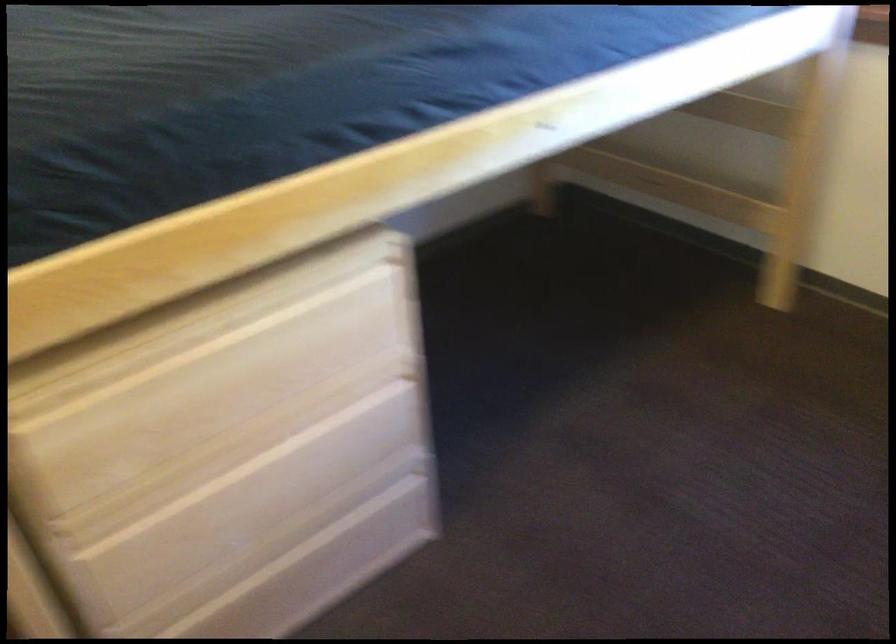
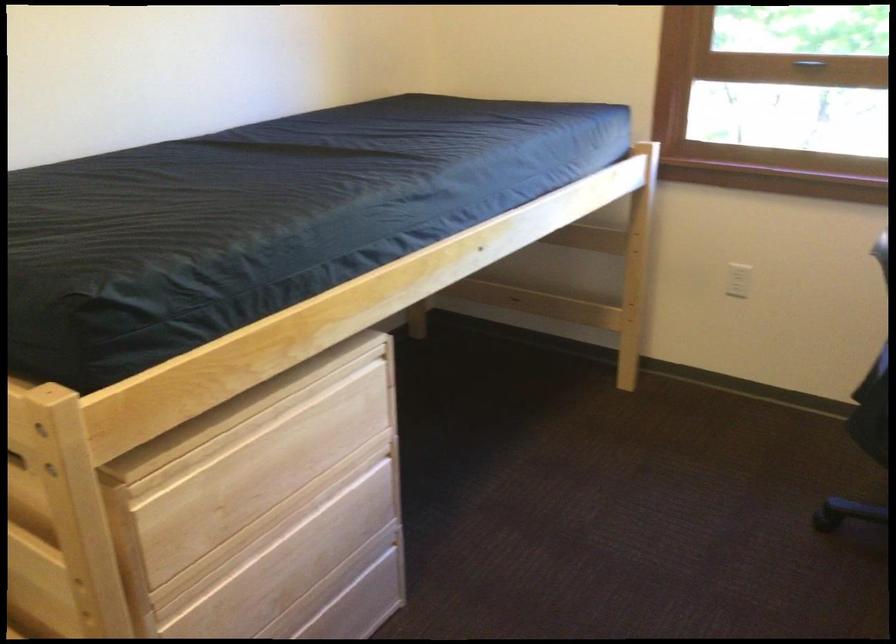
Locate, in the second image, the point that corresponds to point (250, 359) in the first image.

(285, 448)